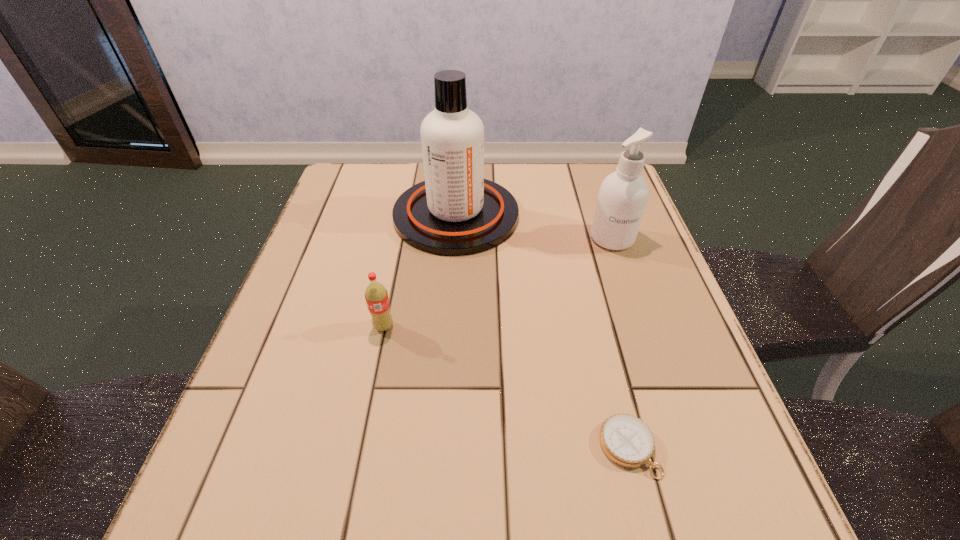
Find the location of a particular element. the taller cleansing agent is located at coordinates (455, 212).

Where is `the left cleansing agent`? the left cleansing agent is located at coordinates pos(455,212).

This screenshot has height=540, width=960. What are the coordinates of `the third shortest object` in the screenshot? It's located at pyautogui.click(x=623, y=195).

I want to click on the shorter cleansing agent, so 623,195.

The width and height of the screenshot is (960, 540). I want to click on the second shortest object, so click(376, 296).

You are a GUI agent. You are given a task and a screenshot of the screen. Output one action in this format:
    pyautogui.click(x=<x>, y=<y>)
    Task: Click on the soda
    The image size is (960, 540).
    Given the screenshot: What is the action you would take?
    pyautogui.click(x=376, y=296)

Identify the location of the shortest object. The height and width of the screenshot is (540, 960). (626, 440).

Identify the location of compass. (626, 440).

Locate an element on the screen. The height and width of the screenshot is (540, 960). free location located 0.340m on the front of the taller cleansing agent is located at coordinates (445, 381).

Find the location of a particular element. Image resolution: width=960 pixels, height=540 pixels. vacant region located on the front label of the third shortest object is located at coordinates (627, 282).